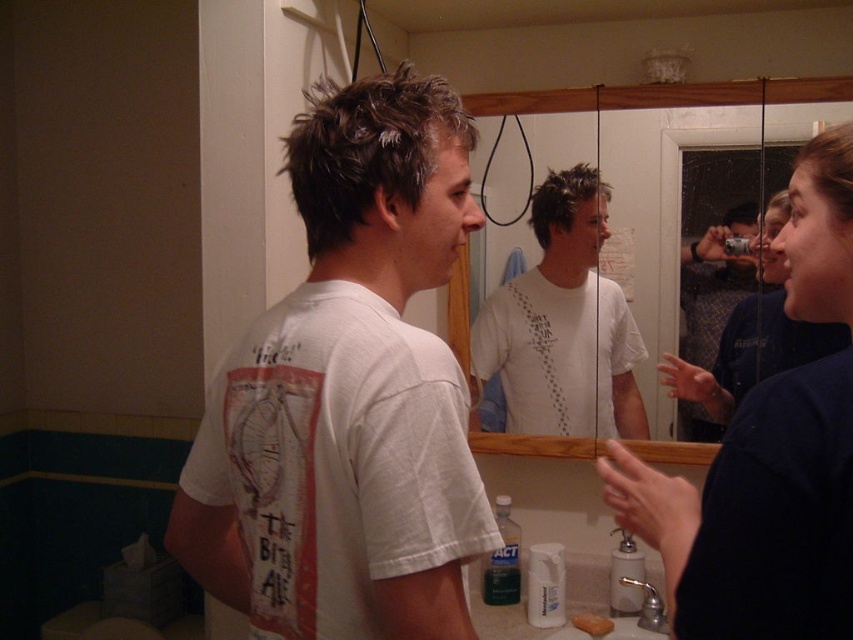
You are standing in a bathroom and want to reach a point marked at coordinates (688,600). If your arm can extend 24 inches, can you comfortably reach that point without moving closer?

The distance of point (688,600) from viewer is 26.54 inches, so no, you cannot comfortably reach it with an arm extension of 24 inches as it is 2.54 inches beyond your reach.

Based on the photo, you are standing in a bathroom and see the dark blue fabric at upper right and the matte glass mirror at center. Which object is located to the left of the other?

The dark blue fabric at upper right is positioned on the left side of matte glass mirror at center.